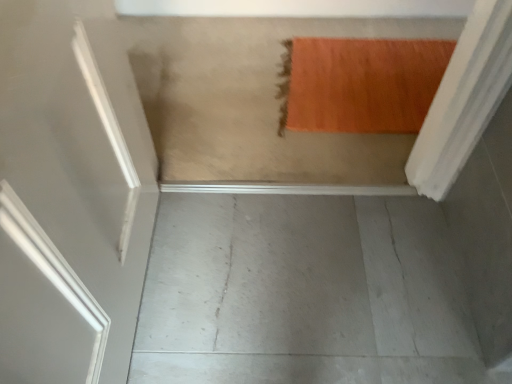
Find the location of a particular element. blank space above gray concrete floor at center (from a real-world perspective) is located at coordinates (284, 271).